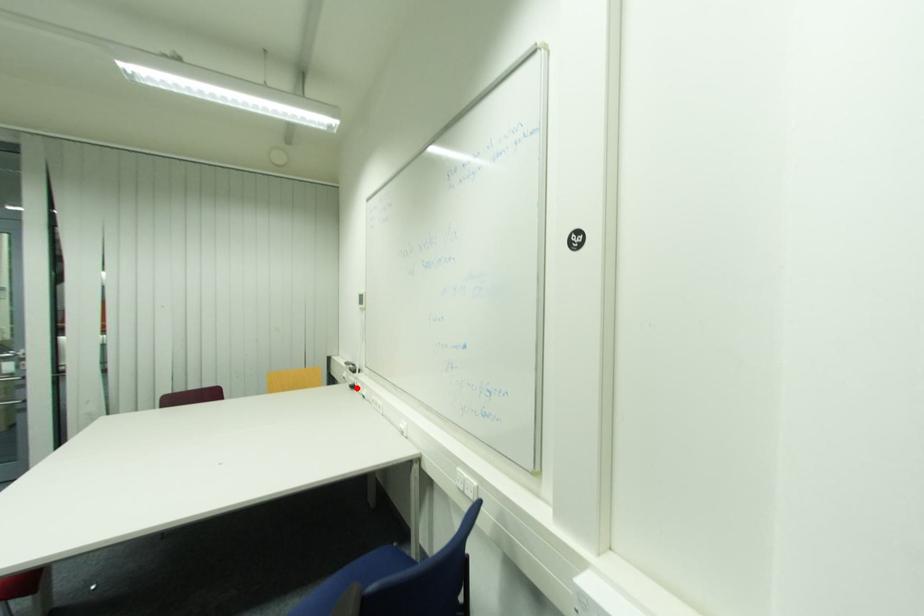
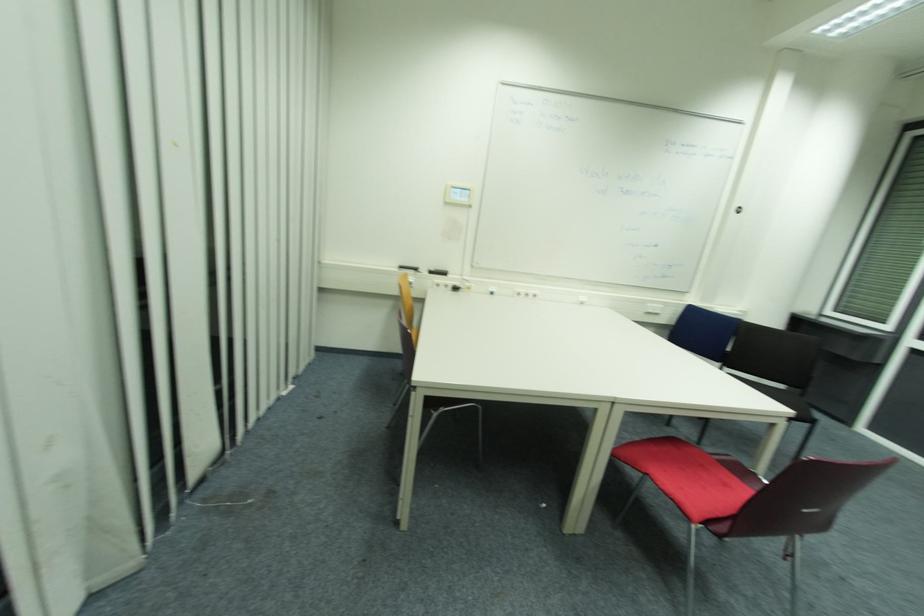
Question: I am providing you with two images of the same scene from different viewpoints. A red point is shown in image1. For the corresponding object point in image2, is it positioned nearer or farther from the camera?

Choices:
 (A) Nearer
 (B) Farther

Answer: (A)